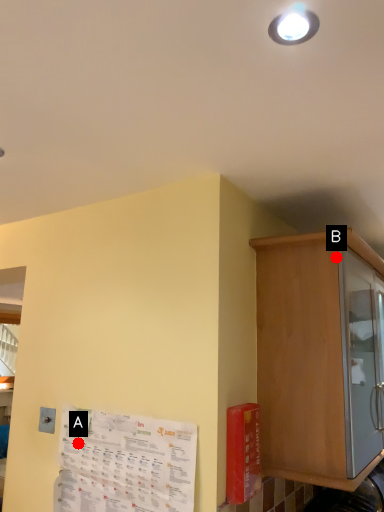
Question: Two points are circled on the image, labeled by A and B beside each circle. Among these points, which one is farthest from the camera?

Choices:
 (A) A is further
 (B) B is further

Answer: (A)